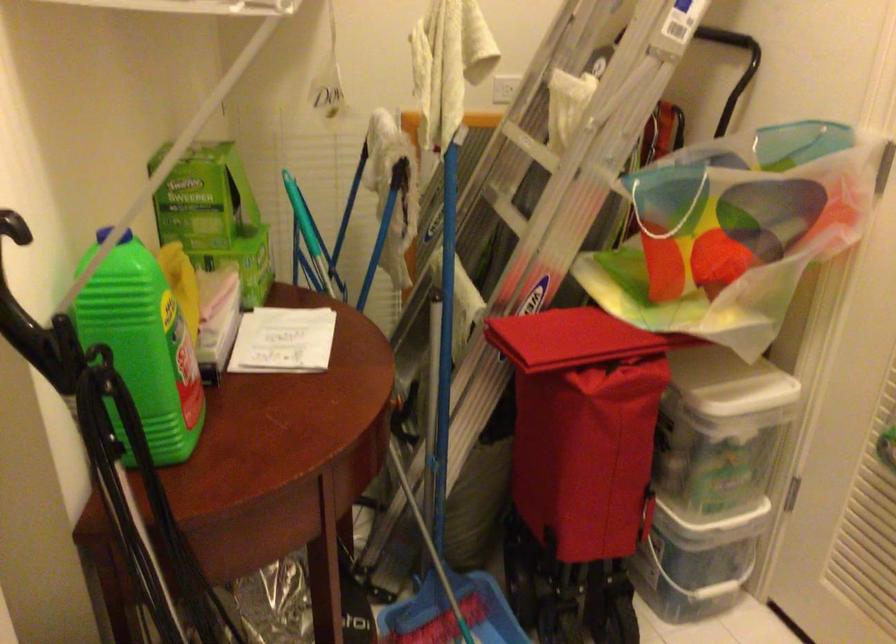
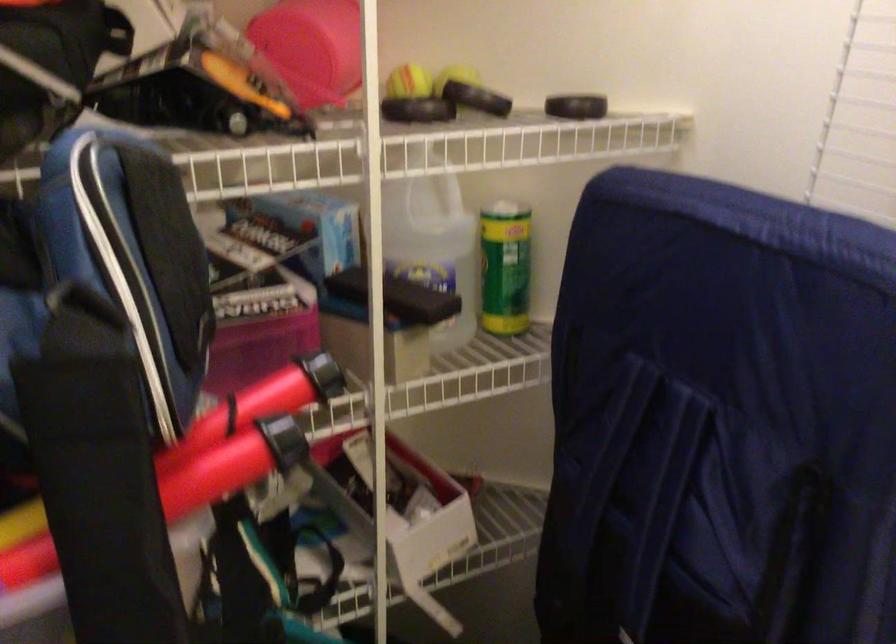
First-person continuous shooting, in which direction is the camera rotating?

The camera rotated toward left-down.